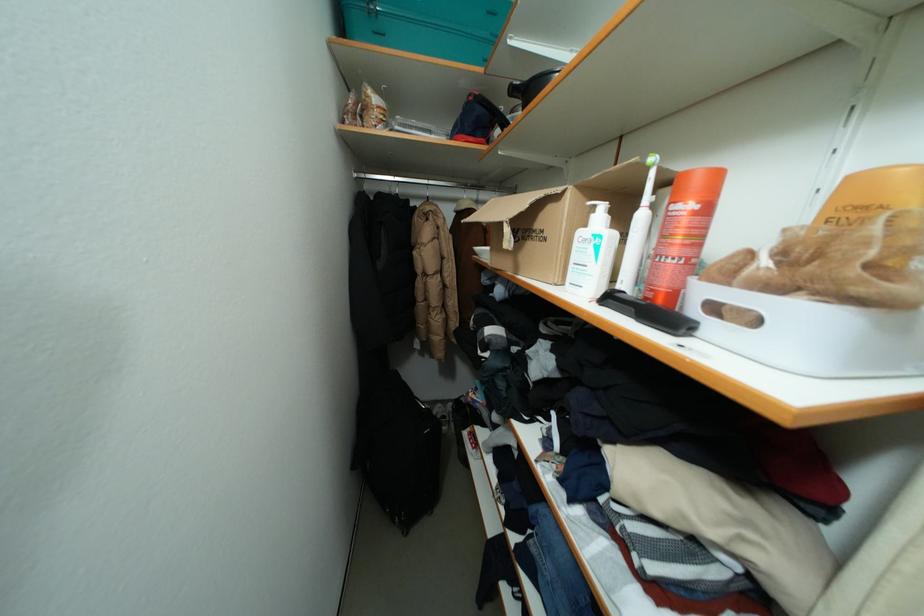
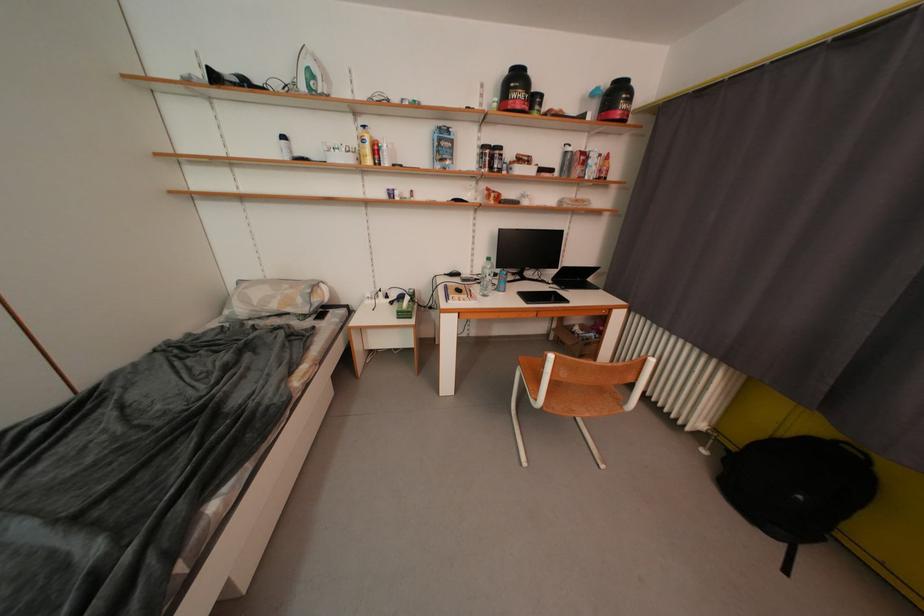
Question: In a continuous first-person perspective shot, in which direction is the camera moving?

Choices:
 (A) Left
 (B) Right
 (C) Forward
 (D) Backward

Answer: (B)